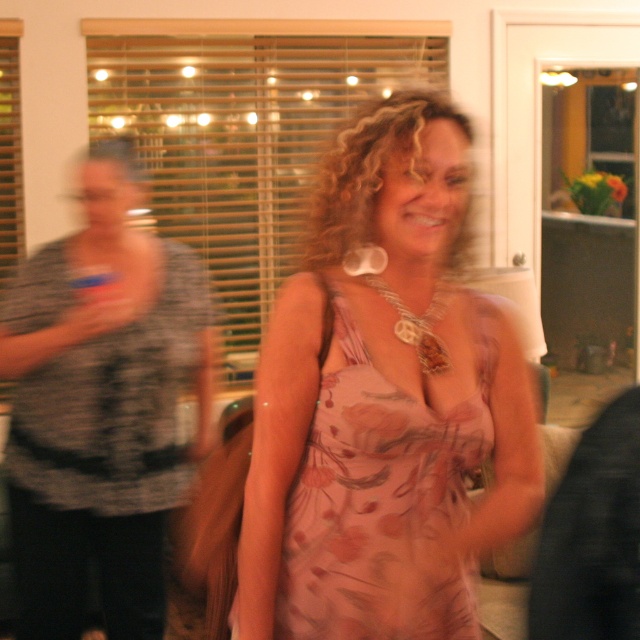
Is point (451, 444) positioned behind point (376, 282)?

No, (451, 444) is in front of (376, 282).

Which is behind, point (285, 602) or point (410, 323)?

Positioned behind is point (410, 323).

In order to click on floral silk dress at center in this screenshot , I will do `click(362, 496)`.